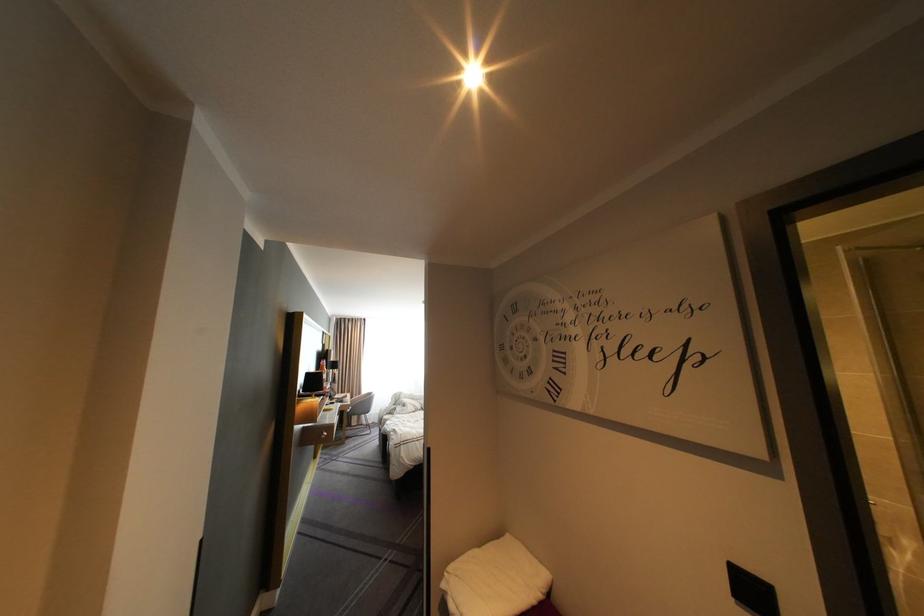
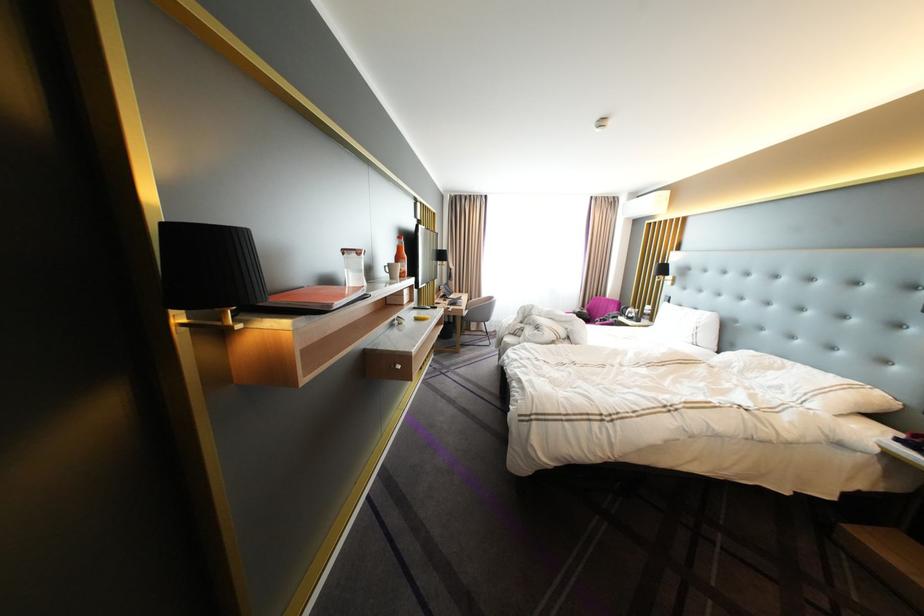
In the second image, find the point that corresponds to point (371, 394) in the first image.

(492, 296)